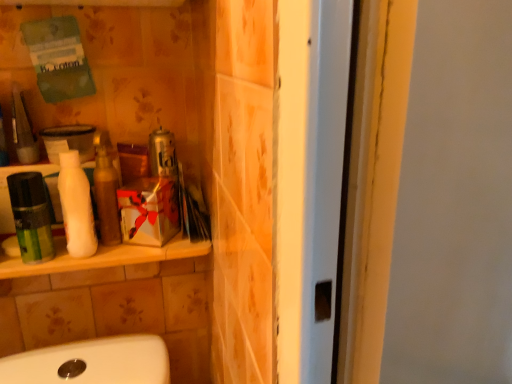
Question: Is white matte bottle at left far away from metallic can at center?

Choices:
 (A) yes
 (B) no

Answer: (B)

Question: Is white matte bottle at left further to the viewer compared to metallic can at center?

Choices:
 (A) no
 (B) yes

Answer: (A)

Question: From the image's perspective, is white matte bottle at left on top of metallic can at center?

Choices:
 (A) yes
 (B) no

Answer: (B)

Question: Is white matte bottle at left closer to the viewer compared to metallic can at center?

Choices:
 (A) yes
 (B) no

Answer: (A)

Question: From a real-world perspective, is white matte bottle at left over metallic can at center?

Choices:
 (A) yes
 (B) no

Answer: (B)

Question: Considering the positions of white matte bottle at left and green matte mouthwash at left in the image, is white matte bottle at left bigger or smaller than green matte mouthwash at left?

Choices:
 (A) small
 (B) big

Answer: (B)

Question: From the image's perspective, is white matte bottle at left above or below green matte mouthwash at left?

Choices:
 (A) above
 (B) below

Answer: (A)

Question: Is point (71, 193) closer or farther from the camera than point (37, 177)?

Choices:
 (A) farther
 (B) closer

Answer: (B)

Question: From a real-world perspective, relative to green matte mouthwash at left, is white matte bottle at left vertically above or below?

Choices:
 (A) above
 (B) below

Answer: (A)

Question: Do you think green matte mouthwash at left is within metallic can at center, or outside of it?

Choices:
 (A) inside
 (B) outside

Answer: (B)

Question: From the image's perspective, is green matte mouthwash at left above or below metallic can at center?

Choices:
 (A) above
 (B) below

Answer: (B)

Question: Considering their positions, is green matte mouthwash at left located in front of or behind metallic can at center?

Choices:
 (A) behind
 (B) front

Answer: (B)

Question: In terms of width, does green matte mouthwash at left look wider or thinner when compared to metallic can at center?

Choices:
 (A) wide
 (B) thin

Answer: (B)

Question: From the image's perspective, is green matte mouthwash at left located above or below white matte bottle at left?

Choices:
 (A) above
 (B) below

Answer: (B)

Question: In the image, is green matte mouthwash at left positioned in front of or behind white matte bottle at left?

Choices:
 (A) behind
 (B) front

Answer: (B)